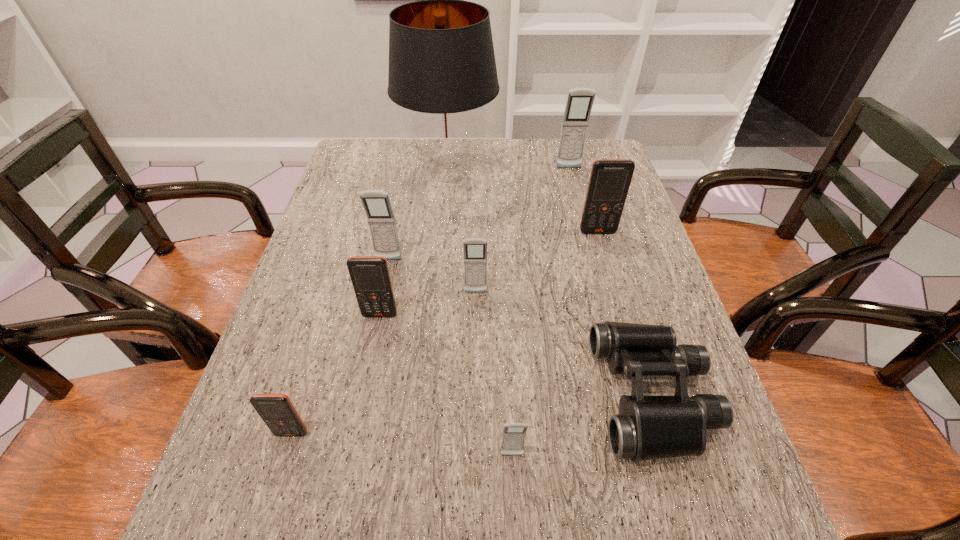
The height and width of the screenshot is (540, 960). I want to click on the tallest object, so click(x=442, y=69).

Where is `lampshade`? The height and width of the screenshot is (540, 960). lampshade is located at coordinates (442, 69).

Where is `the farthest gray cellular telephone`? the farthest gray cellular telephone is located at coordinates (579, 103).

You are a GUI agent. You are given a task and a screenshot of the screen. Output one action in this format:
    pyautogui.click(x=<x>, y=<y>)
    Task: Click on the second tallest object
    The height and width of the screenshot is (540, 960).
    Given the screenshot: What is the action you would take?
    pyautogui.click(x=579, y=103)

The height and width of the screenshot is (540, 960). I want to click on the third smallest gray cellular telephone, so click(x=376, y=203).

Where is `the leftmost gray cellular telephone`? The width and height of the screenshot is (960, 540). the leftmost gray cellular telephone is located at coordinates (376, 203).

Where is `the rightmost orange cellular telephone`? This screenshot has width=960, height=540. the rightmost orange cellular telephone is located at coordinates (610, 179).

You are a GUI agent. You are given a task and a screenshot of the screen. Output one action in this format:
    pyautogui.click(x=<x>, y=<y>)
    Task: Click on the farthest orange cellular telephone
    
    Given the screenshot: What is the action you would take?
    pyautogui.click(x=610, y=179)

Locate an element on the screen. the third farthest gray cellular telephone is located at coordinates (475, 249).

Find the location of a particular element. This screenshot has height=540, width=960. the fifth nearest object is located at coordinates (475, 249).